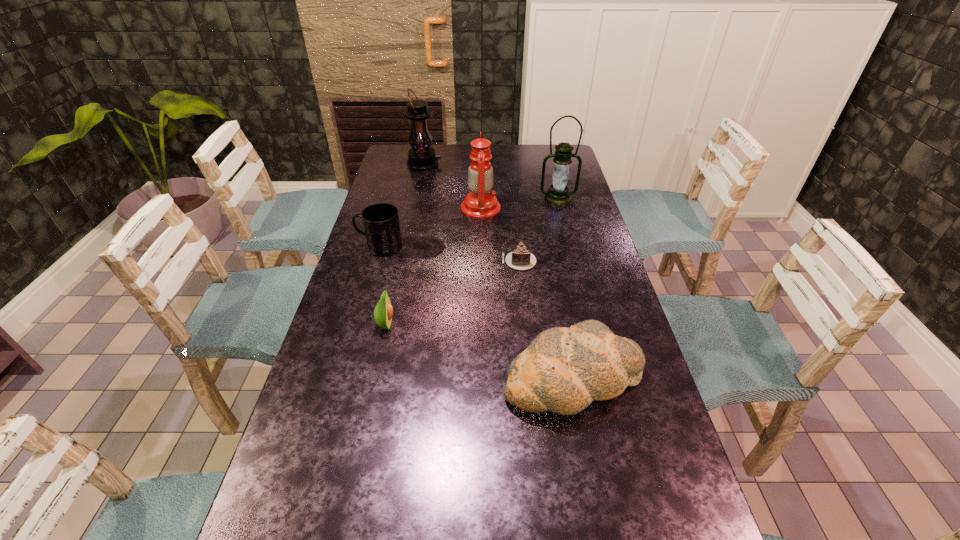
Locate an element on the screen. This screenshot has width=960, height=540. object at the far left corner is located at coordinates (421, 157).

Locate an element on the screen. blank space at the far edge of the desktop is located at coordinates (451, 151).

This screenshot has width=960, height=540. Identify the location of vacant space at the right edge of the desktop. (590, 257).

Image resolution: width=960 pixels, height=540 pixels. In the image, there is a desktop. In order to click on vacant space at the far right corner in this screenshot , I will do `click(543, 158)`.

Where is `empty space that is in between the right lantern and the avocado`? empty space that is in between the right lantern and the avocado is located at coordinates (471, 261).

Where is `unoccupied position between the avocado and the mug`? This screenshot has width=960, height=540. unoccupied position between the avocado and the mug is located at coordinates (x=383, y=286).

Image resolution: width=960 pixels, height=540 pixels. Find the location of `unoccupied area between the nearest object and the mug`. unoccupied area between the nearest object and the mug is located at coordinates (477, 312).

This screenshot has width=960, height=540. In order to click on blank region between the avocado and the mug in this screenshot , I will do `click(383, 286)`.

This screenshot has width=960, height=540. I want to click on blank region between the chocolate cake and the oil lamp, so click(500, 235).

Identify the location of free area in between the avocado and the nearer lantern. (471, 261).